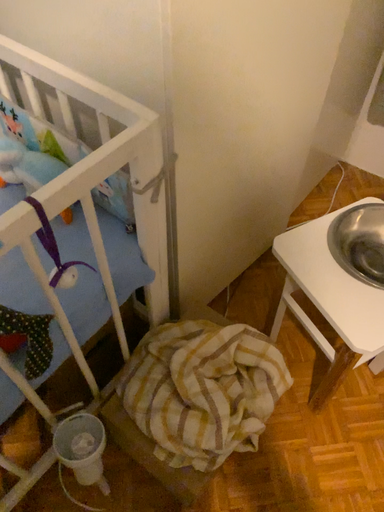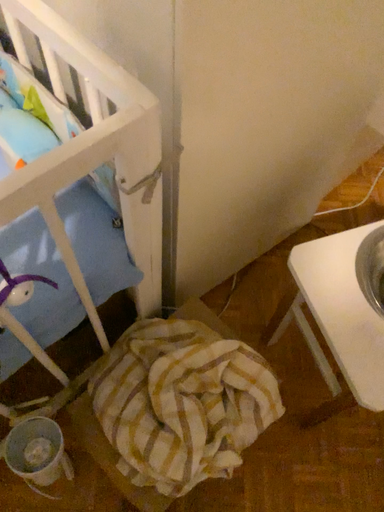
Question: Which way did the camera rotate in the video?

Choices:
 (A) rotated upward
 (B) rotated downward

Answer: (B)